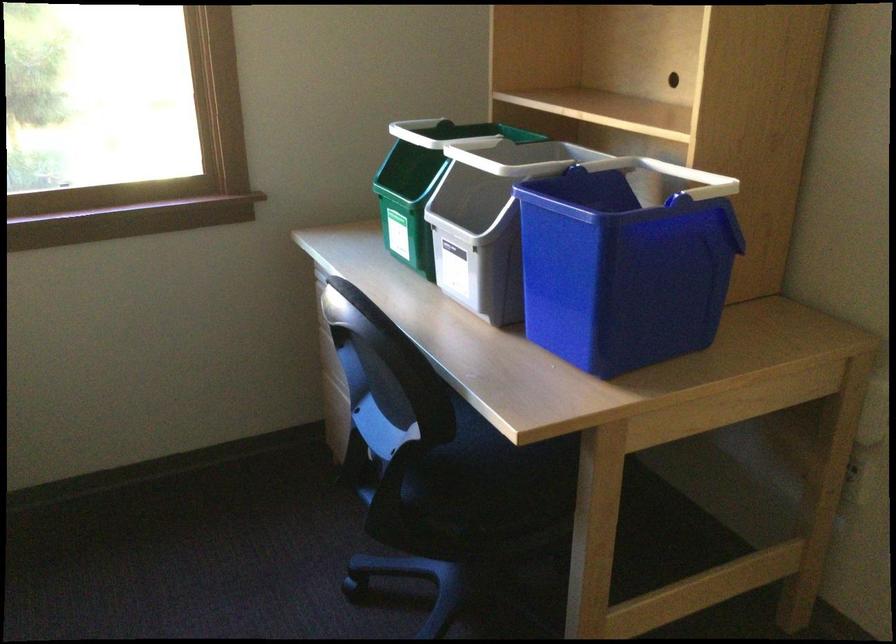
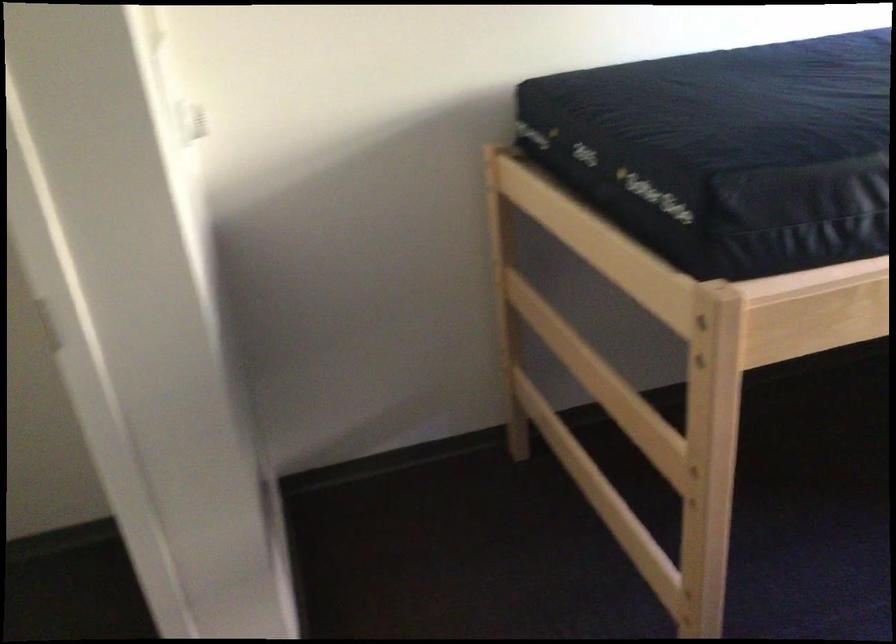
First-person continuous shooting, in which direction is the camera rotating?

The rotation direction of the camera is left-down.